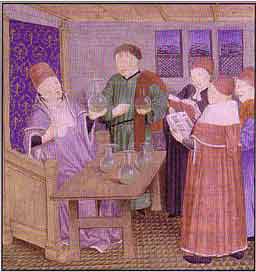
I want to click on book, so click(x=186, y=123), click(x=182, y=105).